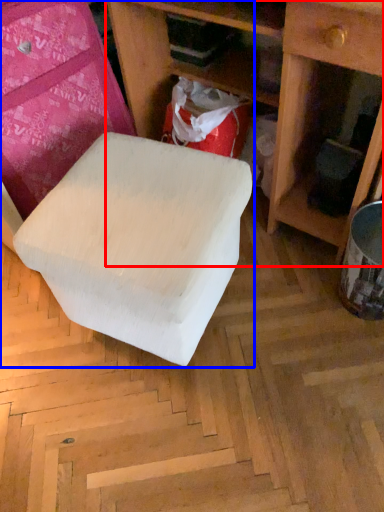
Question: Among these objects, which one is nearest to the camera, shelf (highlighted by a red box) or furniture (highlighted by a blue box)?

Choices:
 (A) shelf
 (B) furniture

Answer: (A)